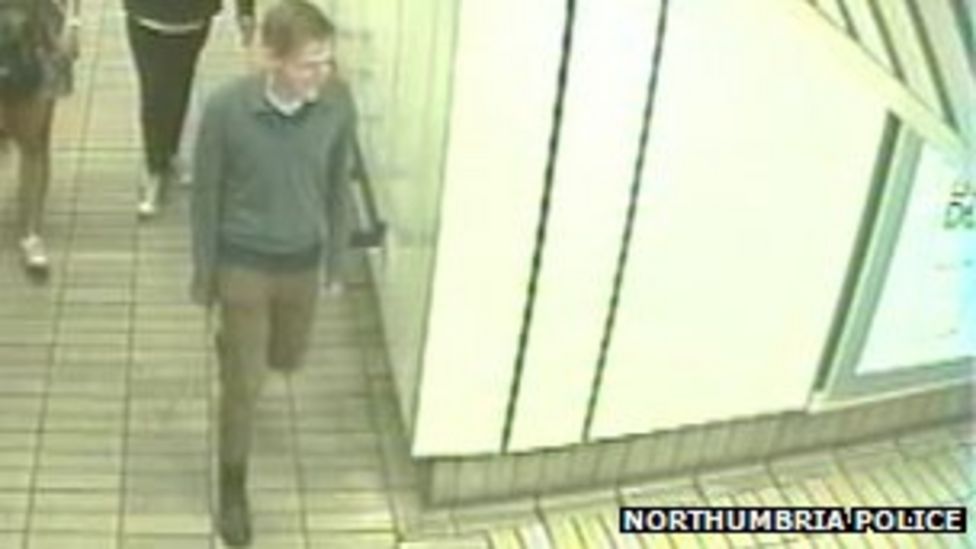
Locate an element on the screen. two vertical stripes going up wall is located at coordinates (553, 158), (633, 192).